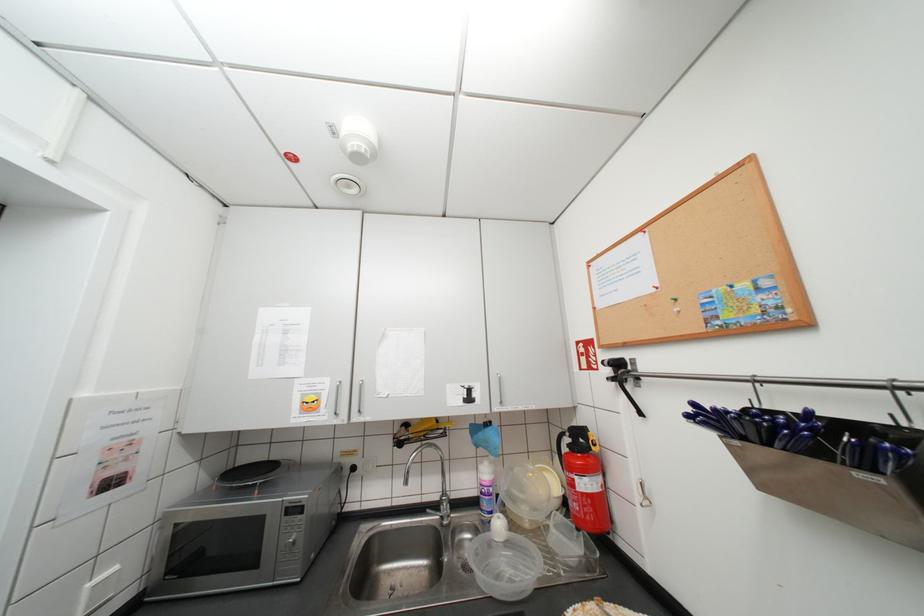
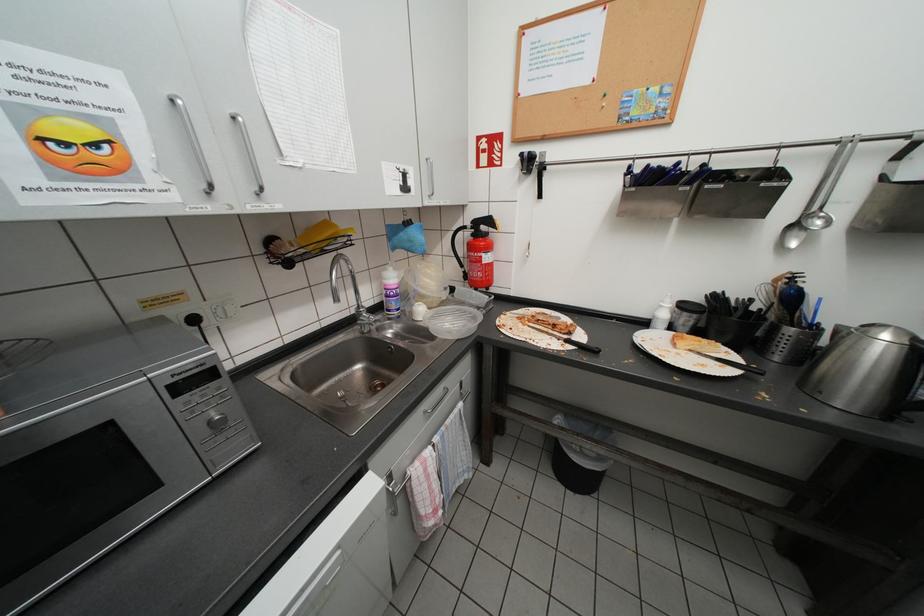
The images are taken continuously from a first-person perspective. In which direction is your viewpoint rotating?

The camera's rotation is toward right-down.